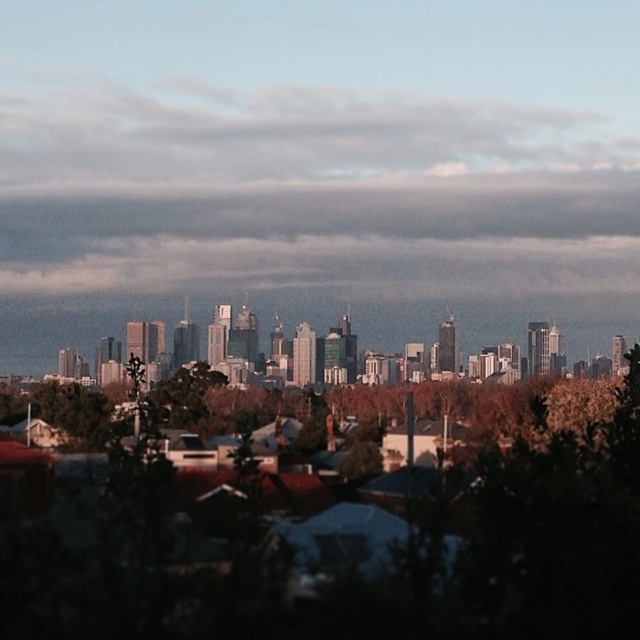
Is green leafy tree at center positioned at the back of cloudy sky at upper center?

No, green leafy tree at center is closer to the viewer.

Which is in front, point (84, 538) or point (173, 113)?

Positioned in front is point (173, 113).

Locate an element on the screen. green leafy tree at center is located at coordinates (352, 556).